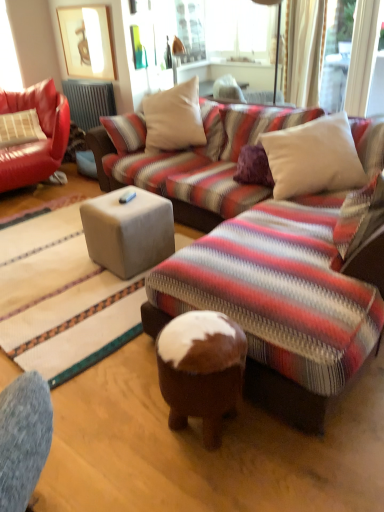
Find the location of a particular element. This screenshot has width=384, height=512. leather pillow at left, positioned as the 2th pillow in right-to-left order is located at coordinates (20, 128).

Where is `metallic gray radiator at upper left`? The width and height of the screenshot is (384, 512). metallic gray radiator at upper left is located at coordinates (89, 102).

This screenshot has height=512, width=384. Describe the element at coordinates (201, 370) in the screenshot. I see `brown suede stool at center` at that location.

Identify the location of white soft cushion at upper right, the 2th pillow from the back. (313, 157).

Describe the element at coordinates (128, 231) in the screenshot. This screenshot has height=512, width=384. I see `suede-like beige cube at center` at that location.

At what (x,y) coordinates should I click in order to perform the action: click on matte wooden picture frame at upper left. Please return your answer as a coordinate pair (x, y). Looking at the image, I should click on (87, 42).

The image size is (384, 512). Find the location of `stool that appears in front of the leather couch at left`. stool that appears in front of the leather couch at left is located at coordinates (201, 370).

From the picture: How much distance is there between leather couch at left and brown suede stool at center?

The distance of leather couch at left from brown suede stool at center is 3.11 meters.

Considering the sizes of objects leather couch at left and brown suede stool at center in the image provided, who is smaller, leather couch at left or brown suede stool at center?

brown suede stool at center is smaller.

Considering the sizes of leather couch at left and brown suede stool at center in the image, is leather couch at left wider or thinner than brown suede stool at center?

leather couch at left is wider than brown suede stool at center.

Considering the relative positions of matte wooden picture frame at upper left and leather couch at left in the image provided, is matte wooden picture frame at upper left to the left of leather couch at left from the viewer's perspective?

In fact, matte wooden picture frame at upper left is to the right of leather couch at left.

How different are the orientations of matte wooden picture frame at upper left and leather couch at left in degrees?

77.8 degrees.

Which is behind, point (83, 77) or point (45, 112)?

Point (83, 77)

Is matte wooden picture frame at upper left far away from leather couch at left?

No, matte wooden picture frame at upper left is not far from leather couch at left.

Which object is positioned more to the right, leather pillow at left, the second pillow ordered from the bottom, or metallic gray radiator at upper left?

metallic gray radiator at upper left is more to the right.

Based on the photo, is metallic gray radiator at upper left at the back of leather pillow at left, placed as the second pillow when sorted from front to back?

leather pillow at left, placed as the second pillow when sorted from front to back, is not turned away from metallic gray radiator at upper left.

Is leather pillow at left, which ranks as the 1th pillow in left-to-right order, closer to the viewer compared to metallic gray radiator at upper left?

Yes, the depth of leather pillow at left, which ranks as the 1th pillow in left-to-right order, is less than that of metallic gray radiator at upper left.

Locate an element on the screen. Image resolution: width=384 pixels, height=512 pixels. radiator lying above the leather pillow at left, positioned as the 2th pillow in right-to-left order (from the image's perspective) is located at coordinates (89, 102).

Between leather pillow at left, placed as the second pillow when sorted from front to back, and brown suede stool at center, which one is positioned behind?

Positioned behind is leather pillow at left, placed as the second pillow when sorted from front to back.

Consider the image. Between leather pillow at left, positioned as the first pillow in back-to-front order, and brown suede stool at center, which one has smaller size?

brown suede stool at center.

From a real-world perspective, which is physically above, leather pillow at left, positioned as the first pillow in back-to-front order, or brown suede stool at center?

leather pillow at left, positioned as the first pillow in back-to-front order, from a real-world perspective.

Does leather pillow at left, the second pillow ordered from the bottom, appear on the left side of brown suede stool at center?

Yes, leather pillow at left, the second pillow ordered from the bottom, is to the left of brown suede stool at center.

Is leather pillow at left, the first pillow viewed from the top, completely or partially inside suede-like beige cube at center?

That's incorrect, leather pillow at left, the first pillow viewed from the top, is not inside suede-like beige cube at center.

From a real-world perspective, is suede-like beige cube at center over leather pillow at left, the first pillow viewed from the top?

No, from a real-world perspective, suede-like beige cube at center is not above leather pillow at left, the first pillow viewed from the top.

Between matte wooden picture frame at upper left and leather pillow at left, placed as the second pillow when sorted from front to back, which one has smaller size?

With smaller size is matte wooden picture frame at upper left.

What's the angular difference between matte wooden picture frame at upper left and leather pillow at left, the first pillow viewed from the top,'s facing directions?

matte wooden picture frame at upper left and leather pillow at left, the first pillow viewed from the top, are facing 58.6 degrees away from each other.

Could you tell me if matte wooden picture frame at upper left is facing leather pillow at left, positioned as the first pillow in back-to-front order?

Yes, matte wooden picture frame at upper left is oriented towards leather pillow at left, positioned as the first pillow in back-to-front order.

Is matte wooden picture frame at upper left closer to the viewer compared to leather pillow at left, the second pillow ordered from the bottom?

No, it is not.

Considering the positions of objects white soft cushion at upper right, acting as the 1th pillow starting from the front, and metallic gray radiator at upper left in the image provided, who is more to the left, white soft cushion at upper right, acting as the 1th pillow starting from the front, or metallic gray radiator at upper left?

metallic gray radiator at upper left is more to the left.

Is white soft cushion at upper right, the 1th pillow when ordered from right to left, not close to metallic gray radiator at upper left?

white soft cushion at upper right, the 1th pillow when ordered from right to left, is far away from metallic gray radiator at upper left.

From a real-world perspective, is white soft cushion at upper right, acting as the 1th pillow starting from the front, physically located above or below metallic gray radiator at upper left?

white soft cushion at upper right, acting as the 1th pillow starting from the front, is situated higher than metallic gray radiator at upper left in the real world.

From the picture: Is white soft cushion at upper right, the 1th pillow when ordered from right to left, in front of or behind metallic gray radiator at upper left in the image?

Clearly, white soft cushion at upper right, the 1th pillow when ordered from right to left, is in front of metallic gray radiator at upper left.

This screenshot has height=512, width=384. In order to click on studio couch behind the brown suede stool at center in this screenshot , I will do `click(37, 141)`.

The width and height of the screenshot is (384, 512). I want to click on picture frame above the leather couch at left (from the image's perspective), so click(87, 42).

Which object lies nearer to the anchor point metallic gray radiator at upper left, leather couch at left or suede-like beige cube at center?

leather couch at left lies closer to metallic gray radiator at upper left than the other object.

From the image, which object appears to be farther from leather pillow at left, positioned as the 2th pillow in right-to-left order, suede-like beige cube at center or brown suede stool at center?

brown suede stool at center is further to leather pillow at left, positioned as the 2th pillow in right-to-left order.

Considering their positions, is leather pillow at left, the first pillow viewed from the top, positioned further to leather couch at left than brown suede stool at center?

brown suede stool at center.

From the image, which object appears to be farther from matte wooden picture frame at upper left, suede-like beige cube at center or leather pillow at left, positioned as the 2th pillow in right-to-left order?

The object further to matte wooden picture frame at upper left is suede-like beige cube at center.

From the image, which object appears to be farther from suede-like beige cube at center, matte wooden picture frame at upper left or brown suede stool at center?

matte wooden picture frame at upper left.

Considering their positions, is leather couch at left positioned further to white soft cushion at upper right, the 2th pillow from the back, than metallic gray radiator at upper left?

leather couch at left is positioned further to the anchor white soft cushion at upper right, the 2th pillow from the back.

Based on their spatial positions, is leather couch at left or metallic gray radiator at upper left further from leather pillow at left, the first pillow viewed from the top?

metallic gray radiator at upper left is further to leather pillow at left, the first pillow viewed from the top.

When comparing their distances from metallic gray radiator at upper left, does suede-like beige cube at center or brown suede stool at center seem closer?

suede-like beige cube at center.

Where is `table between brown suede stool at center and matte wooden picture frame at upper left in the front-back direction`? This screenshot has width=384, height=512. table between brown suede stool at center and matte wooden picture frame at upper left in the front-back direction is located at coordinates (128, 231).

Identify the location of table between brown suede stool at center and leather couch at left from front to back. Image resolution: width=384 pixels, height=512 pixels. (128, 231).

In order to click on pillow located between suede-like beige cube at center and metallic gray radiator at upper left in the depth direction in this screenshot , I will do `click(20, 128)`.

Where is `pillow between brown suede stool at center and leather pillow at left, the first pillow viewed from the top, from front to back`? This screenshot has height=512, width=384. pillow between brown suede stool at center and leather pillow at left, the first pillow viewed from the top, from front to back is located at coordinates (313, 157).